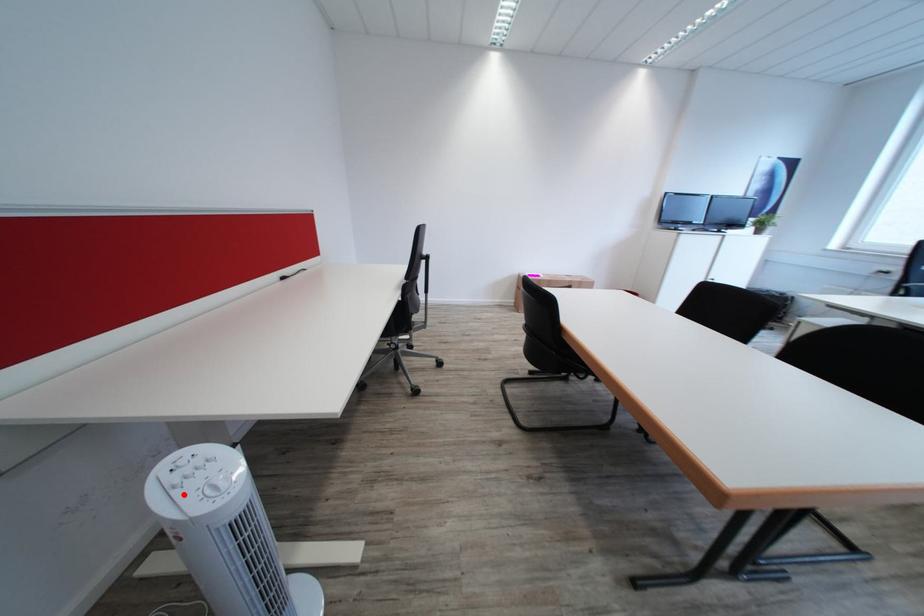
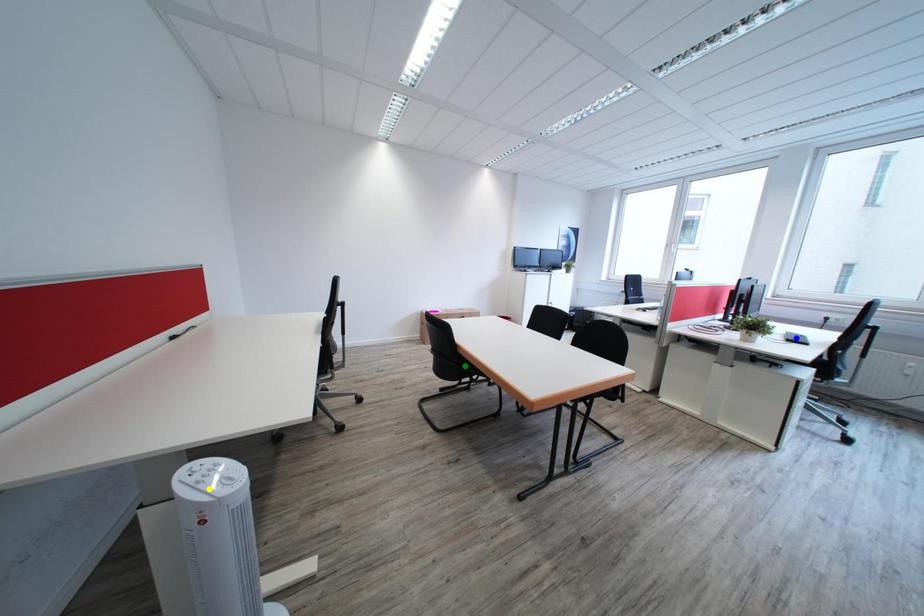
Question: I am providing you with two images of the same scene from different viewpoints. A red point is marked on the first image. You are given multiple points on the second image. In image 2, which mark is for the same physical point as the one in image 1?

Choices:
 (A) yellow point
 (B) blue point
 (C) green point

Answer: (A)